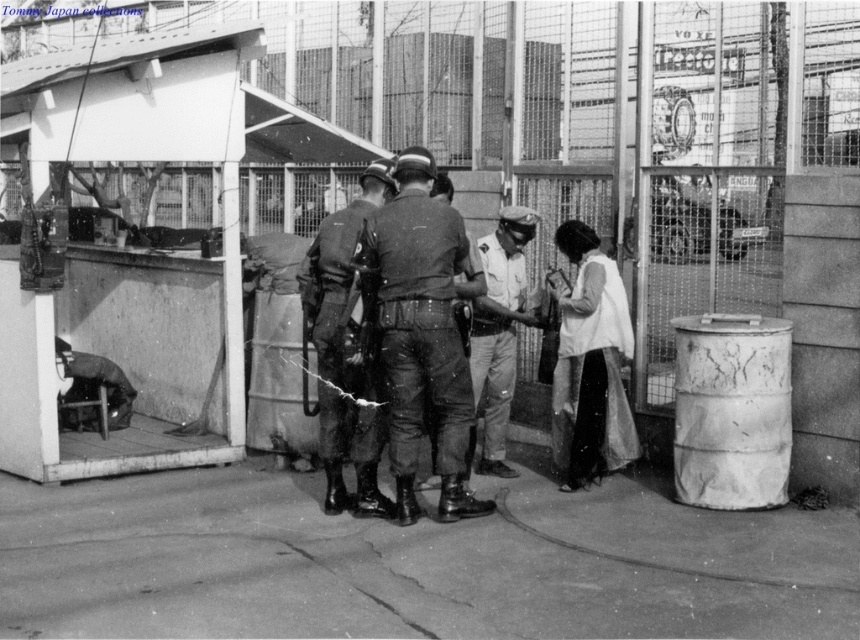
In the scene shown: Is uniformed man at center shorter than white matte uniform at center?

No, uniformed man at center is not shorter than white matte uniform at center.

Who is taller, uniformed man at center or white matte uniform at center?

With more height is uniformed man at center.

Where is `uniformed man at center`? This screenshot has height=640, width=860. uniformed man at center is located at coordinates (344, 349).

Identify the location of uniformed man at center. (344, 349).

Does white matte dress at lower right appear under white matte uniform at center?

Correct, white matte dress at lower right is located below white matte uniform at center.

From the picture: Measure the distance between point (612, 381) and camera.

The distance of point (612, 381) from camera is 24.17 feet.

The width and height of the screenshot is (860, 640). Identify the location of white matte dress at lower right. (593, 376).

Does dark green fabric uniform at center appear over uniformed man at center?

Indeed, dark green fabric uniform at center is positioned over uniformed man at center.

Which of these two, dark green fabric uniform at center or uniformed man at center, stands shorter?

With less height is dark green fabric uniform at center.

Is point (410, 182) in front of point (339, 387)?

Yes, point (410, 182) is in front of point (339, 387).

What are the coordinates of `dark green fabric uniform at center` in the screenshot? It's located at (421, 323).